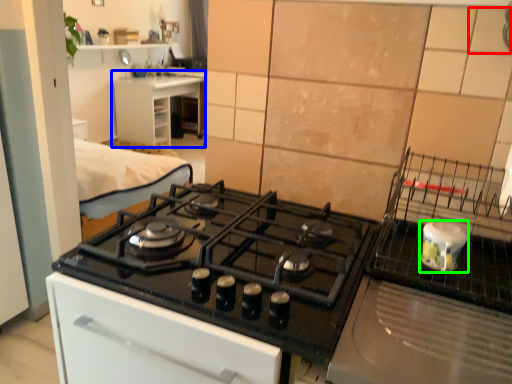
Question: Estimate the real-world distances between objects in this image. Which object is farther from tile (highlighted by a red box), counter top (highlighted by a blue box) or kitchen appliance (highlighted by a green box)?

Choices:
 (A) counter top
 (B) kitchen appliance

Answer: (A)